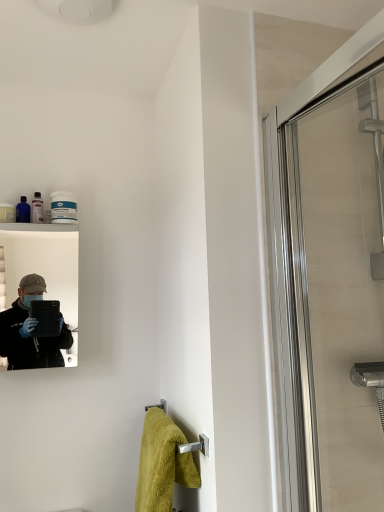
Question: Based on their sizes in the image, would you say clear glass shower door at right is bigger or smaller than matte black mirror at left?

Choices:
 (A) small
 (B) big

Answer: (B)

Question: Choose the correct answer: Is clear glass shower door at right inside matte black mirror at left or outside it?

Choices:
 (A) inside
 (B) outside

Answer: (B)

Question: Which object is positioned farthest from the matte black mirror at left?

Choices:
 (A) soft yellow towel at lower center
 (B) clear glass shower door at right

Answer: (B)

Question: Considering the real-world distances, which object is farthest from the matte black mirror at left?

Choices:
 (A) soft yellow towel at lower center
 (B) clear glass shower door at right

Answer: (B)